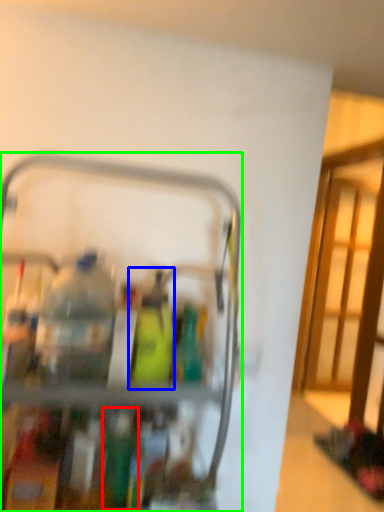
Question: Estimate the real-world distances between objects in this image. Which object is closer to bottle (highlighted by a red box), bottle (highlighted by a blue box) or appliance (highlighted by a green box)?

Choices:
 (A) bottle
 (B) appliance

Answer: (A)